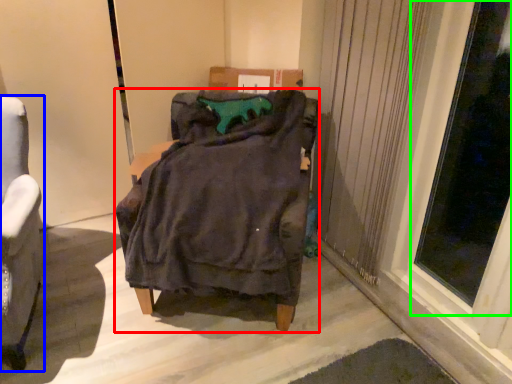
Question: Estimate the real-world distances between objects in this image. Which object is farther from furniture (highlighted by a red box), chair (highlighted by a blue box) or window (highlighted by a green box)?

Choices:
 (A) chair
 (B) window

Answer: (B)